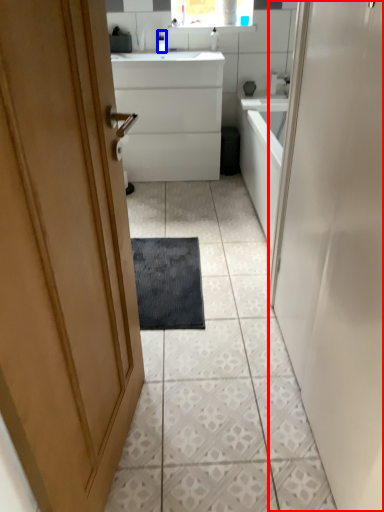
Question: Which object appears closest to the camera in this image, door (highlighted by a red box) or toiletry (highlighted by a blue box)?

Choices:
 (A) door
 (B) toiletry

Answer: (A)